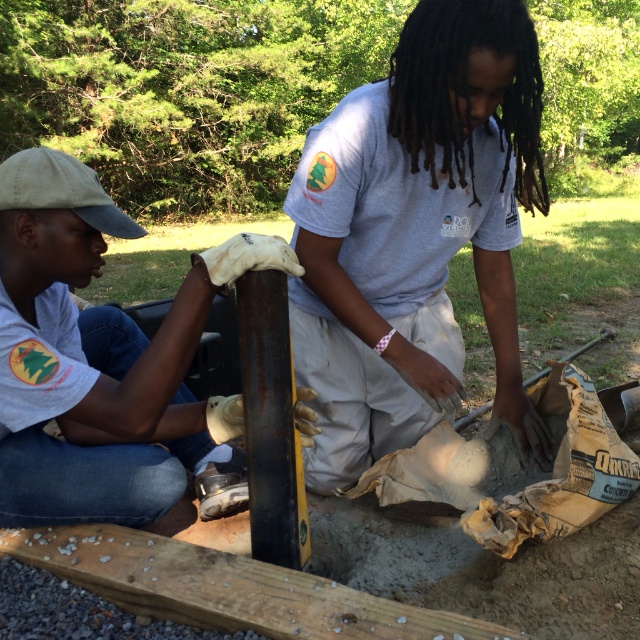
Question: Does smooth wooden plank at center have a larger size compared to rusty metal pole at center?

Choices:
 (A) no
 (B) yes

Answer: (B)

Question: Considering the real-world distances, which object is farthest from the white matte cap at upper left?

Choices:
 (A) smooth wooden plank at center
 (B) smooth yellow shovel at lower center

Answer: (B)

Question: Can you confirm if white matte cap at upper left is bigger than rusty metal pole at center?

Choices:
 (A) yes
 (B) no

Answer: (A)

Question: Which object is the farthest from the white matte cap at upper left?

Choices:
 (A) smooth wooden plank at center
 (B) smooth yellow shovel at lower center
 (C) rusty metal pole at center

Answer: (B)

Question: Which object is closer to the camera taking this photo?

Choices:
 (A) rusty metal pole at center
 (B) white matte cap at upper left

Answer: (B)

Question: Is white matte cap at upper left bigger than smooth wooden plank at center?

Choices:
 (A) no
 (B) yes

Answer: (B)